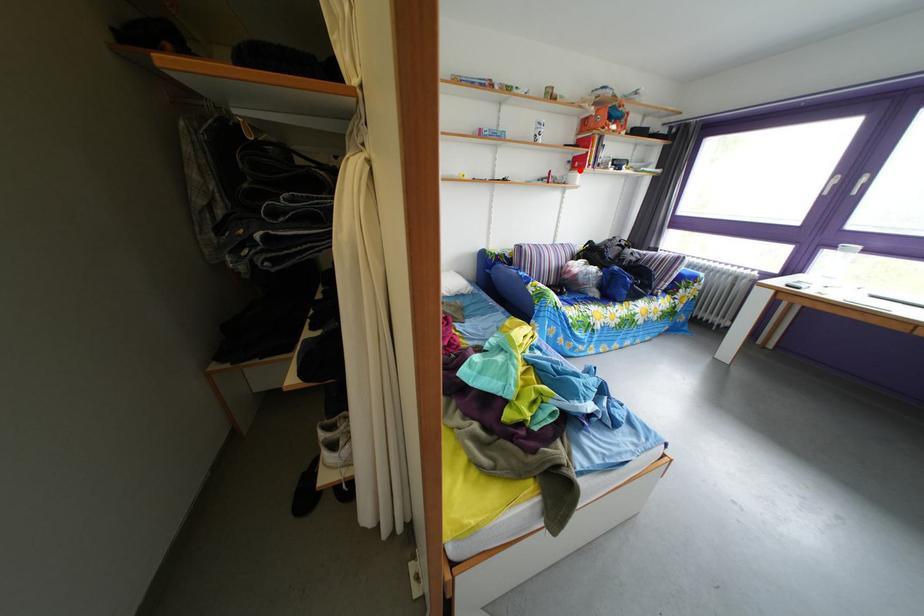
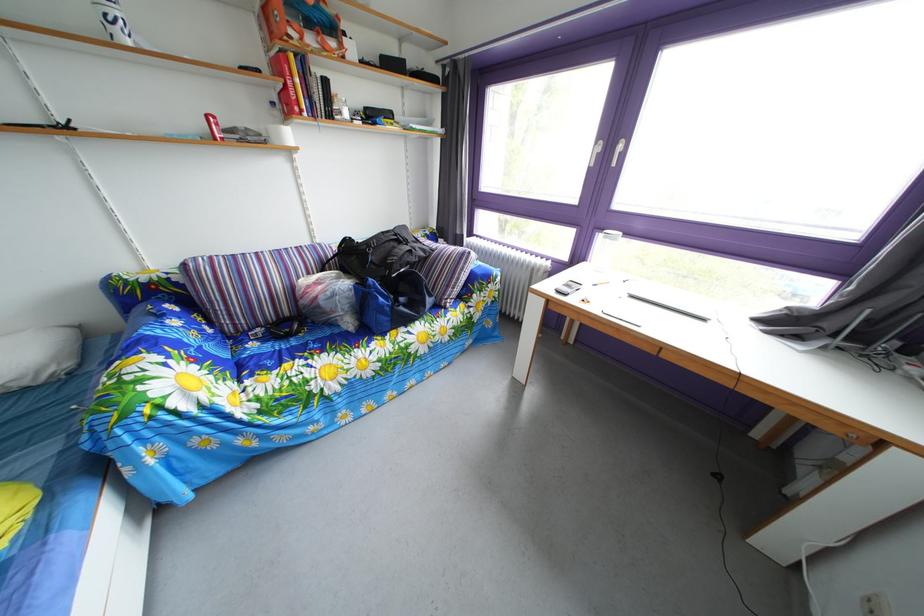
Find the pixel in the second image that matches the highlighted location in the first image.

(284, 111)